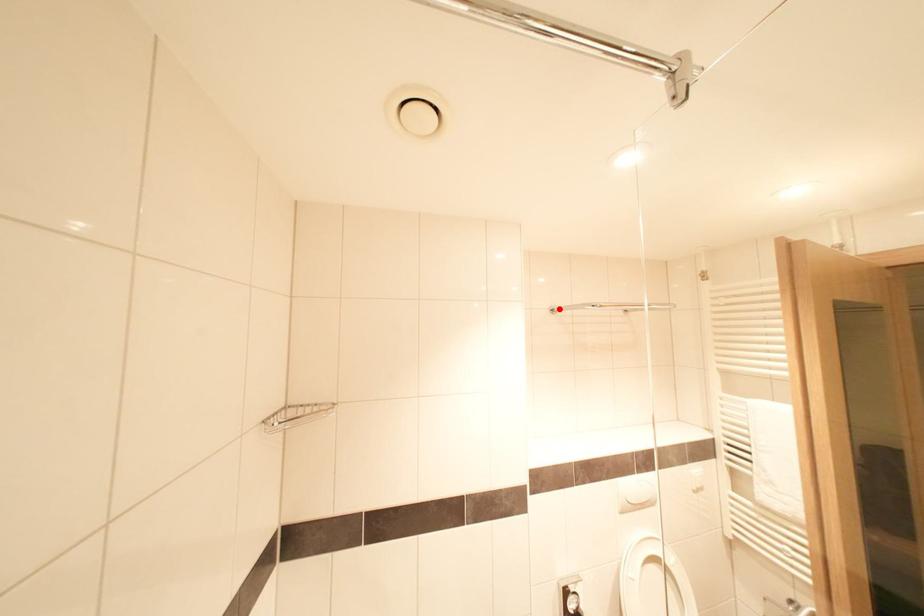
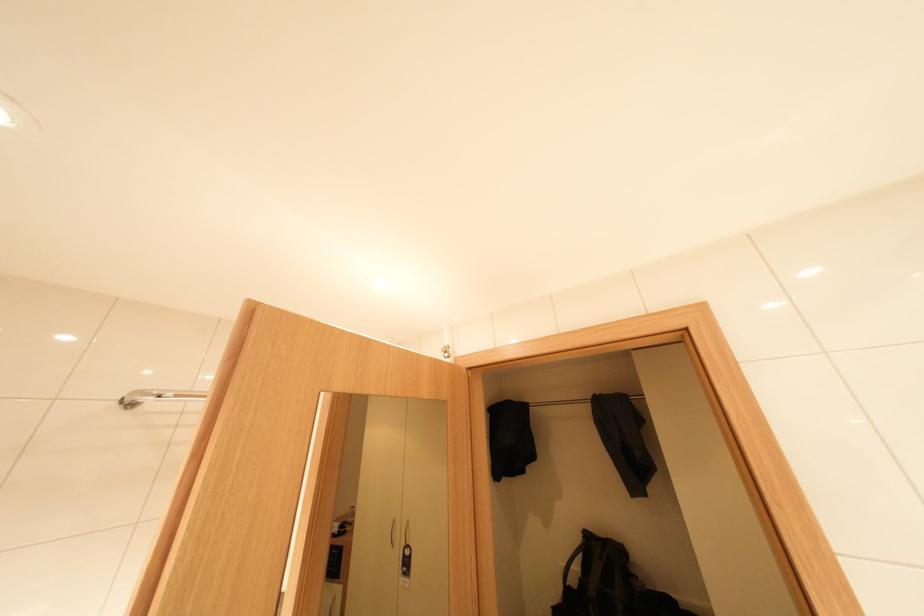
Where in the second image is the point corresponding to the highlighted location from the first image?

(130, 399)